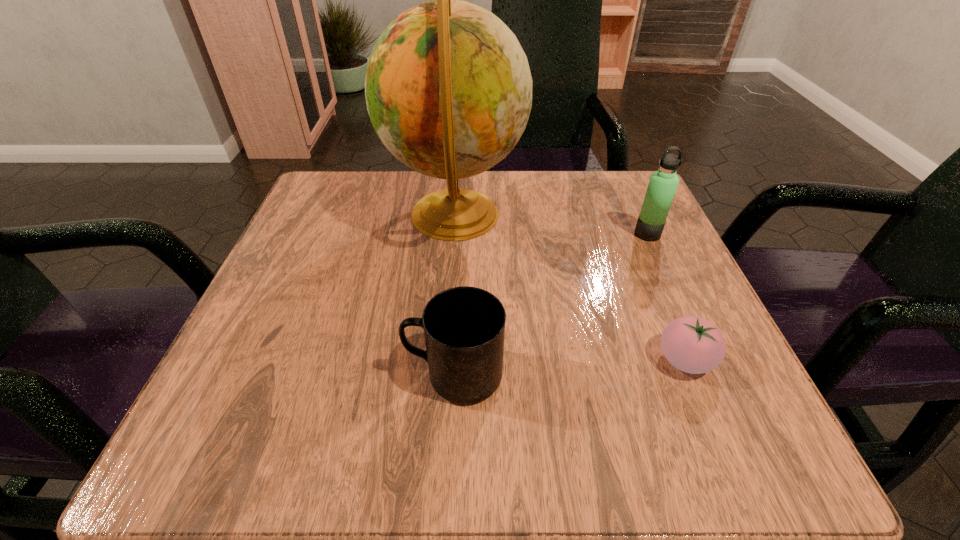
Find the location of `globe`. globe is located at coordinates (448, 88).

Locate an element on the screen. The width and height of the screenshot is (960, 540). the second tallest object is located at coordinates (663, 183).

At what (x,y) coordinates should I click in order to perform the action: click on the second shortest object. Please return your answer as a coordinate pair (x, y). The height and width of the screenshot is (540, 960). Looking at the image, I should click on (464, 327).

You are a GUI agent. You are given a task and a screenshot of the screen. Output one action in this format:
    pyautogui.click(x=<x>, y=<y>)
    Task: Click on the tomato
    This screenshot has width=960, height=540.
    Given the screenshot: What is the action you would take?
    pyautogui.click(x=692, y=344)

Find the location of `vacant space situated on the front of the globe`. vacant space situated on the front of the globe is located at coordinates (446, 346).

At what (x,y) coordinates should I click in order to perform the action: click on vacant area situated 0.400m on the left of the second tallest object. Please return your answer as a coordinate pair (x, y). Looking at the image, I should click on (429, 234).

Where is `vacant area situated 0.210m on the side of the mug with the handle`? The image size is (960, 540). vacant area situated 0.210m on the side of the mug with the handle is located at coordinates (257, 375).

You are a GUI agent. You are given a task and a screenshot of the screen. Output one action in this format:
    pyautogui.click(x=<x>, y=<y>)
    Task: Click on the vacant area situated on the side of the mug with the handle
    
    Given the screenshot: What is the action you would take?
    pyautogui.click(x=222, y=375)

At what (x,y) coordinates should I click in order to perform the action: click on free region located on the side of the mug with the handle. Please return your answer as a coordinate pair (x, y). Image resolution: width=960 pixels, height=540 pixels. Looking at the image, I should click on (286, 375).

Find the location of a particular element. The height and width of the screenshot is (540, 960). vacant space located on the left of the tomato is located at coordinates (443, 360).